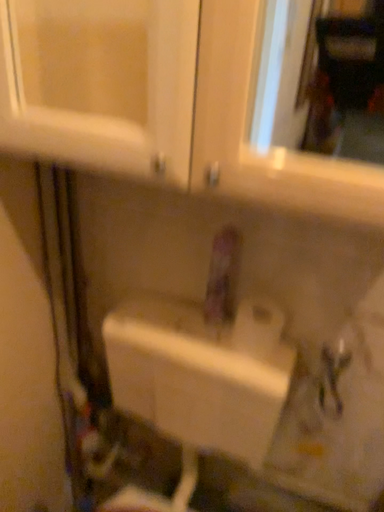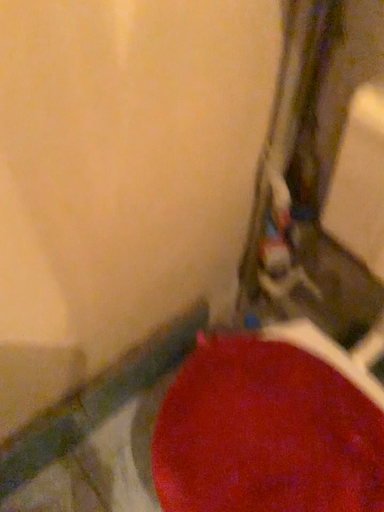
Question: Which way did the camera rotate in the video?

Choices:
 (A) rotated right
 (B) rotated left

Answer: (B)